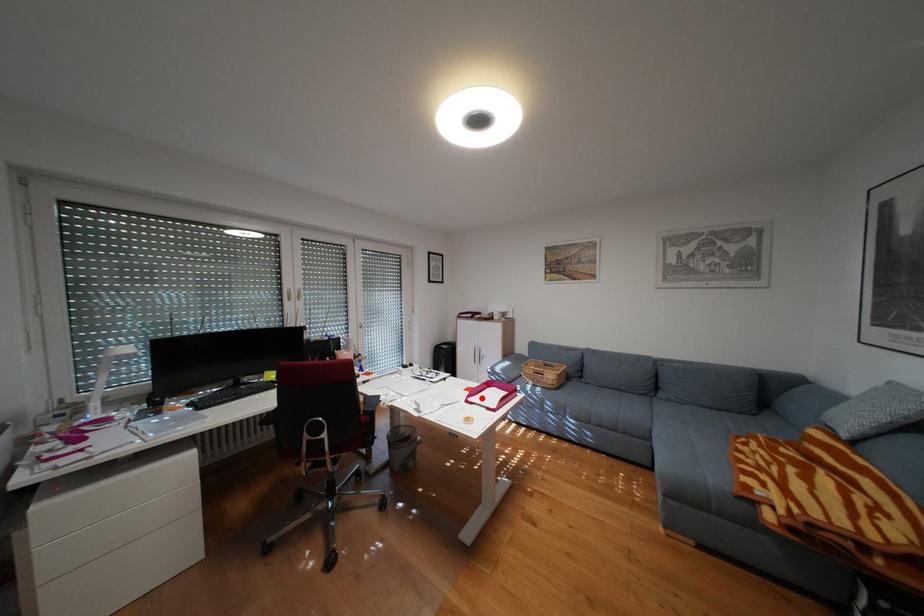
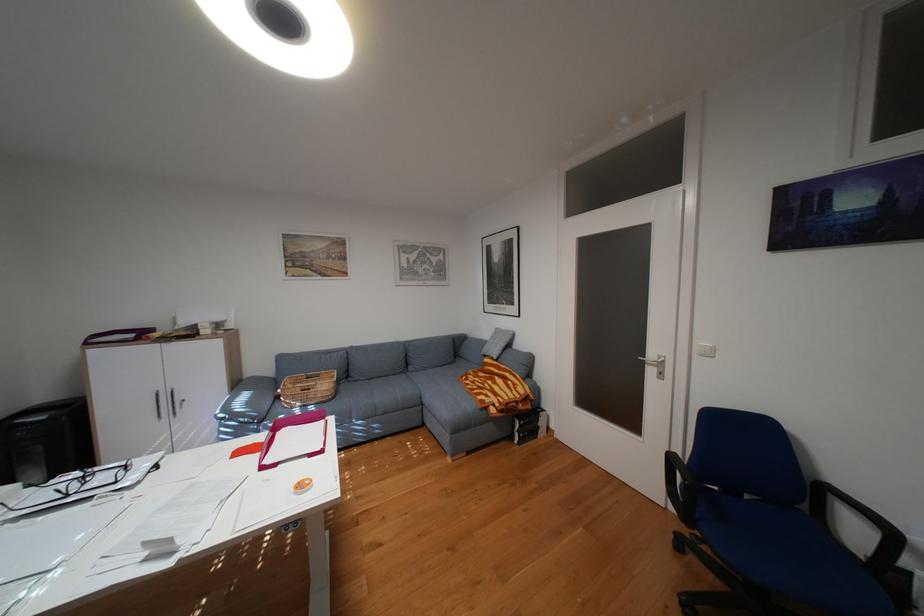
Where in the second image is the point corresponding to the highlighted location from the first image?

(280, 460)